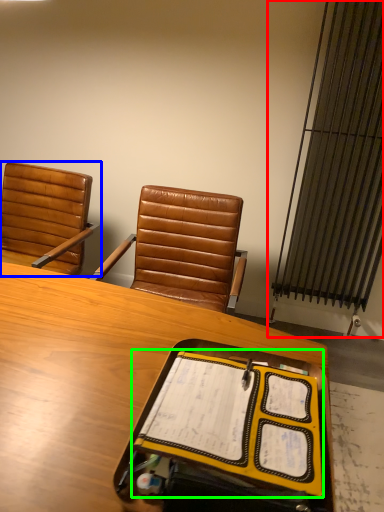
Question: Based on their relative distances, which object is nearer to radiator (highlighted by a red box)? Choose from chair (highlighted by a blue box) and notebook (highlighted by a green box).

Choices:
 (A) chair
 (B) notebook

Answer: (A)